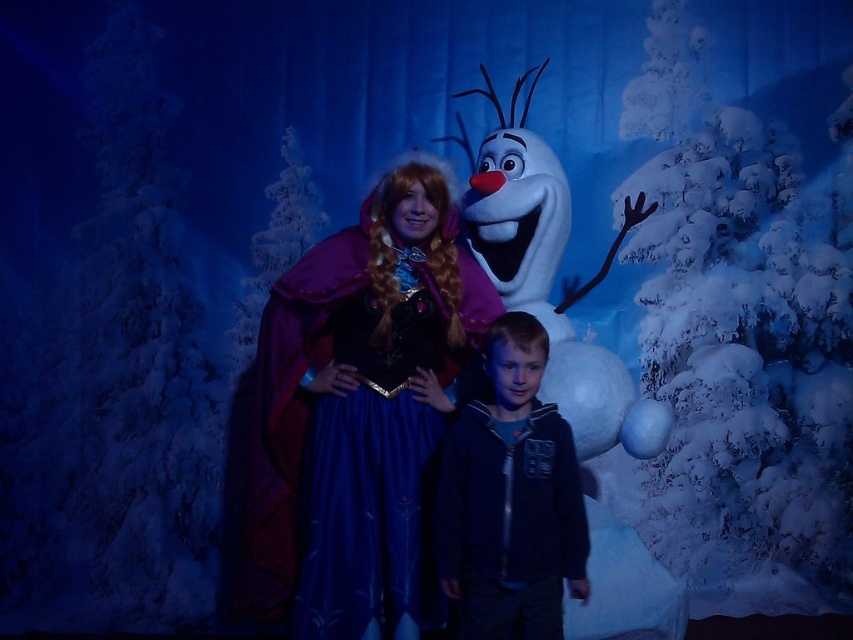
You are a photographer at this winter event and want to take a group photo of Anna and the boy with the white fluffy snowman at center in the background. The camera you are using has a maximum focus range of 2.5 meters. Will you be able to capture all three subjects clearly in one shot?

The distance between Anna and the boy is 2.70 meters, which exceeds the camera maximum focus range of 2.5 meters. Therefore, you cannot capture all three subjects clearly in one shot.